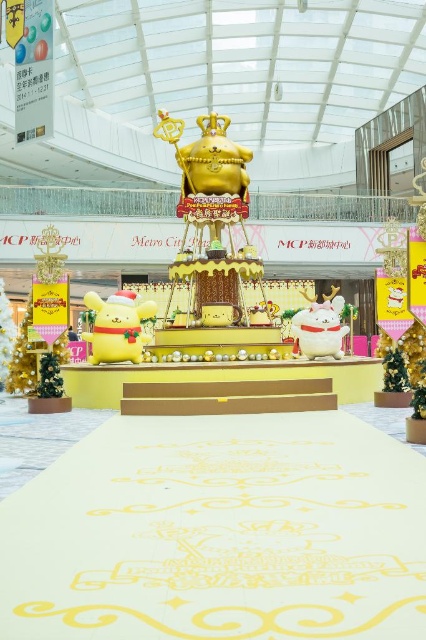
You are standing at the point marked as point [106,339] in the scene. You want to take a photo of the golden throne and the golden bear figure on top of it. Is the golden throne and the golden bear figure on top of it visible from your current position?

The golden throne and the golden bear figure on top of it are visible from point [106,339] because there is no obstruction mentioned in the scene description that would block the view.

Please provide the exact 2D coordinates of the yellow plush toy at center in the image. The answer should be in the format of a point with two decimal numbers separated by a comma, like this example format point_x,point_y. The coordinates should be normalized between 0 and 1, where 0 represents the minimum value and 1 represents the maximum value along each axis. The first number is the x coordinate, and the second is the y coordinate. Please do not add any extra text or explanation in your answer. Just the

(117, 326)

You are a parent at Metro City Plaza and want to buy a plush toy for your child. You see the yellow plush toy at center and the white plush cat at center. Which one is bigger?

The white plush cat at center is bigger than the yellow plush toy at center.